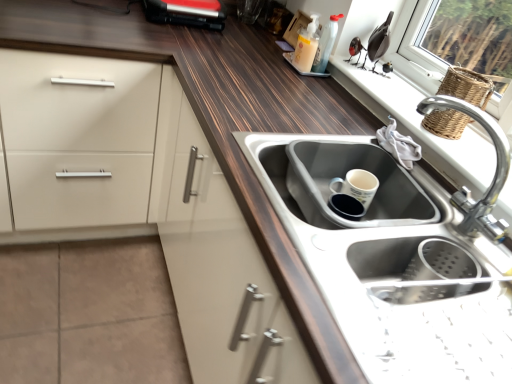
Describe the element at coordinates (333, 178) in the screenshot. I see `satin steel sink at center, the second sink when ordered from right to left` at that location.

Measure the distance between point (322,142) and camera.

Answer: Point (322,142) is 3.69 feet from camera.

What do you see at coordinates (466, 86) in the screenshot? I see `woven brown basket at upper right` at bounding box center [466, 86].

Measure the distance between point (x=485, y=215) and camera.

Point (x=485, y=215) is 38.03 inches from camera.

Locate an element on the screen. The height and width of the screenshot is (384, 512). wooden window sill at upper right is located at coordinates (420, 126).

Identify the location of satin steel sink at center, which is the 1th sink from left to right. This screenshot has height=384, width=512. (333, 178).

Considering the points (455, 89) and (314, 42), which point is in front, point (455, 89) or point (314, 42)?

The point (455, 89) is in front.

Can you tell me how much woven brown basket at upper right and translucent plastic soap dispenser at upper center, which is counted as the 1th bottle, starting from the left, differ in facing direction?

The angular difference between woven brown basket at upper right and translucent plastic soap dispenser at upper center, which is counted as the 1th bottle, starting from the left, is 7.75 degrees.

Based on the photo, could you tell me if woven brown basket at upper right is facing translucent plastic soap dispenser at upper center, which is counted as the 1th bottle, starting from the left?

No, woven brown basket at upper right is not oriented towards translucent plastic soap dispenser at upper center, which is counted as the 1th bottle, starting from the left.

Is woven brown basket at upper right not close to translucent plastic soap dispenser at upper center, which is counted as the 1th bottle, starting from the left?

Actually, woven brown basket at upper right and translucent plastic soap dispenser at upper center, which is counted as the 1th bottle, starting from the left, are a little close together.

From the image's perspective, which is above, wooden window sill at upper right or woven brown basket at upper right?

woven brown basket at upper right.

From the picture: From a real-world perspective, is wooden window sill at upper right positioned above or below woven brown basket at upper right?

Clearly, from a real-world perspective, wooden window sill at upper right is below woven brown basket at upper right.

In the scene shown: Is wooden window sill at upper right spatially inside woven brown basket at upper right, or outside of it?

wooden window sill at upper right lies outside woven brown basket at upper right.

Considering the sizes of objects wooden window sill at upper right and woven brown basket at upper right in the image provided, who is taller, wooden window sill at upper right or woven brown basket at upper right?

With more height is woven brown basket at upper right.

Between stainless steel sink at lower right, the first sink positioned from the right, and woven brown basket at upper right, which one has smaller size?

With smaller size is woven brown basket at upper right.

Is stainless steel sink at lower right, the first sink positioned from the right, wider or thinner than woven brown basket at upper right?

stainless steel sink at lower right, the first sink positioned from the right, is wider than woven brown basket at upper right.

Considering their positions, is stainless steel sink at lower right, the first sink positioned from the right, located in front of or behind woven brown basket at upper right?

Visually, stainless steel sink at lower right, the first sink positioned from the right, is located in front of woven brown basket at upper right.

Which sink is the 2nd one when counting from the front of the woven brown basket at upper right? Please provide its 2D coordinates.

[(380, 260)]

Does translucent plastic soap dispenser at upper center, which is the second bottle from right to left, have a smaller size compared to satin steel sink at center, the second sink when ordered from right to left?

Yes, translucent plastic soap dispenser at upper center, which is the second bottle from right to left, is smaller than satin steel sink at center, the second sink when ordered from right to left.

Are translucent plastic soap dispenser at upper center, which is counted as the 1th bottle, starting from the left, and satin steel sink at center, the second sink when ordered from right to left, making contact?

No, translucent plastic soap dispenser at upper center, which is counted as the 1th bottle, starting from the left, is not touching satin steel sink at center, the second sink when ordered from right to left.

How many degrees apart are the facing directions of translucent plastic soap dispenser at upper center, which is counted as the 1th bottle, starting from the left, and satin steel sink at center, which is the 1th sink from left to right?

The angle between the facing direction of translucent plastic soap dispenser at upper center, which is counted as the 1th bottle, starting from the left, and the facing direction of satin steel sink at center, which is the 1th sink from left to right, is 3.82 degrees.

From a real-world perspective, is translucent plastic soap dispenser at upper center, which is counted as the 1th bottle, starting from the left, physically above satin steel sink at center, the second sink when ordered from right to left?

Correct, in the physical world, translucent plastic soap dispenser at upper center, which is counted as the 1th bottle, starting from the left, is higher than satin steel sink at center, the second sink when ordered from right to left.

Does wooden window sill at upper right have a lesser width compared to satin steel sink at center, which is the 1th sink from left to right?

Indeed, wooden window sill at upper right has a lesser width compared to satin steel sink at center, which is the 1th sink from left to right.

In the image, is wooden window sill at upper right on the left side or the right side of satin steel sink at center, the second sink when ordered from right to left?

wooden window sill at upper right is positioned on satin steel sink at center, the second sink when ordered from right to left,'s right side.

Which is behind, wooden window sill at upper right or satin steel sink at center, which is the 1th sink from left to right?

wooden window sill at upper right is further from the camera.

Is stainless steel sink at lower right, the first sink positioned from the right, touching translucent plastic soap dispenser at upper center, which is the second bottle from right to left?

stainless steel sink at lower right, the first sink positioned from the right, is not next to translucent plastic soap dispenser at upper center, which is the second bottle from right to left, and they're not touching.

Looking at their sizes, would you say stainless steel sink at lower right, the first sink positioned from the right, is wider or thinner than translucent plastic soap dispenser at upper center, which is counted as the 1th bottle, starting from the left?

In the image, stainless steel sink at lower right, the first sink positioned from the right, appears to be wider than translucent plastic soap dispenser at upper center, which is counted as the 1th bottle, starting from the left.

Considering the relative sizes of stainless steel sink at lower right, the first sink positioned from the right, and translucent plastic soap dispenser at upper center, which is counted as the 1th bottle, starting from the left, in the image provided, is stainless steel sink at lower right, the first sink positioned from the right, smaller than translucent plastic soap dispenser at upper center, which is counted as the 1th bottle, starting from the left,?

No, stainless steel sink at lower right, the first sink positioned from the right, is not smaller than translucent plastic soap dispenser at upper center, which is counted as the 1th bottle, starting from the left.

Is woven brown basket at upper right facing away from translucent plastic bottle at upper right, the 1th bottle from the right?

No, woven brown basket at upper right's orientation is not away from translucent plastic bottle at upper right, the 1th bottle from the right.

In the scene shown: Does woven brown basket at upper right lie in front of translucent plastic bottle at upper right, the 1th bottle from the right?

Yes, woven brown basket at upper right is closer to the camera.

Considering the positions of objects woven brown basket at upper right and translucent plastic bottle at upper right, the 1th bottle from the right, in the image provided, who is more to the left, woven brown basket at upper right or translucent plastic bottle at upper right, the 1th bottle from the right,?

Positioned to the left is translucent plastic bottle at upper right, the 1th bottle from the right.

This screenshot has height=384, width=512. Find the location of `bottle that is the 1st object located behind the woven brown basket at upper right`. bottle that is the 1st object located behind the woven brown basket at upper right is located at coordinates (306, 46).

Locate an element on the screen. The width and height of the screenshot is (512, 384). window sill in front of the woven brown basket at upper right is located at coordinates (420, 126).

Which object lies further to the anchor point satin steel sink at center, the second sink when ordered from right to left, woven brown basket at upper right or silver metallic faucet at upper right?

Among the two, woven brown basket at upper right is located further to satin steel sink at center, the second sink when ordered from right to left.

Estimate the real-world distances between objects in this image. Which object is further from translucent plastic soap dispenser at upper center, which is the second bottle from right to left, satin steel sink at center, the second sink when ordered from right to left, or woven brown basket at upper right?

satin steel sink at center, the second sink when ordered from right to left.

From the image, which object appears to be farther from satin steel sink at center, which is the 1th sink from left to right, stainless steel sink at lower right, the first sink positioned from the right, or translucent plastic bottle at upper right, the second bottle positioned from the left?

translucent plastic bottle at upper right, the second bottle positioned from the left, is further to satin steel sink at center, which is the 1th sink from left to right.

Based on their spatial positions, is translucent plastic bottle at upper right, the second bottle positioned from the left, or silver metallic faucet at upper right closer to translucent plastic soap dispenser at upper center, which is counted as the 1th bottle, starting from the left?

The object closer to translucent plastic soap dispenser at upper center, which is counted as the 1th bottle, starting from the left, is translucent plastic bottle at upper right, the second bottle positioned from the left.

When comparing their distances from silver metallic faucet at upper right, does wooden window sill at upper right or woven brown basket at upper right seem closer?

wooden window sill at upper right is closer to silver metallic faucet at upper right.

Looking at the image, which one is located further to woven brown basket at upper right, translucent plastic bottle at upper right, the 1th bottle from the right, or wooden window sill at upper right?

Among the two, translucent plastic bottle at upper right, the 1th bottle from the right, is located further to woven brown basket at upper right.

From the image, which object appears to be nearer to translucent plastic soap dispenser at upper center, which is counted as the 1th bottle, starting from the left, silver metallic faucet at upper right or wooden window sill at upper right?

Among the two, wooden window sill at upper right is located nearer to translucent plastic soap dispenser at upper center, which is counted as the 1th bottle, starting from the left.

Which object lies further to the anchor point silver metallic faucet at upper right, woven brown basket at upper right or translucent plastic soap dispenser at upper center, which is the second bottle from right to left?

translucent plastic soap dispenser at upper center, which is the second bottle from right to left, lies further to silver metallic faucet at upper right than the other object.

Identify the location of window sill between satin steel sink at center, the second sink when ordered from right to left, and translucent plastic bottle at upper right, the 1th bottle from the right, from front to back. (420, 126).

The width and height of the screenshot is (512, 384). I want to click on window sill between stainless steel sink at lower right, the first sink positioned from the right, and translucent plastic bottle at upper right, the 1th bottle from the right, from front to back, so click(x=420, y=126).

Locate an element on the screen. tap between satin steel sink at center, the second sink when ordered from right to left, and wooden window sill at upper right from left to right is located at coordinates click(493, 177).

This screenshot has width=512, height=384. Identify the location of bottle located between woven brown basket at upper right and translucent plastic bottle at upper right, the second bottle positioned from the left, in the depth direction. (306, 46).